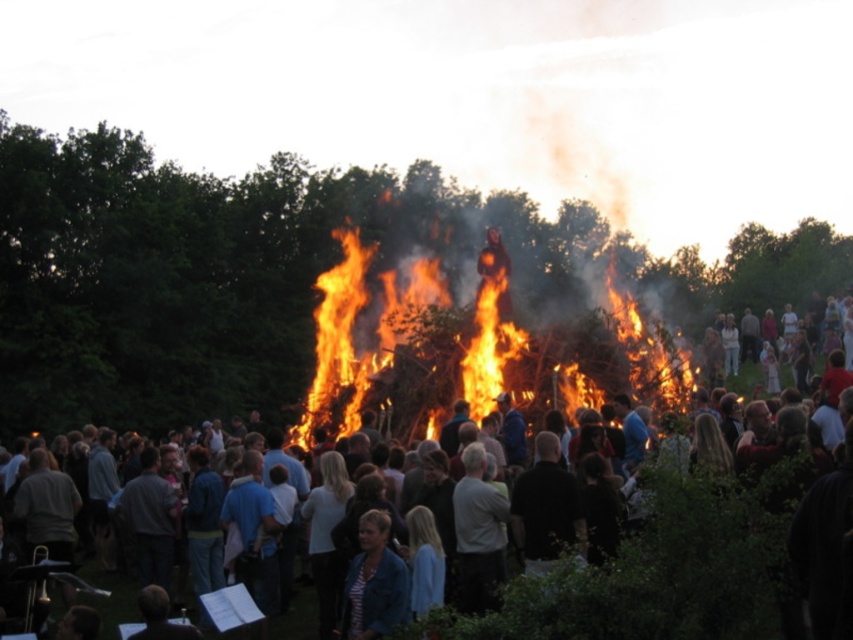
Does dark clothing crowd at center lie behind flaming wood at center?

No, it is in front of flaming wood at center.

Is point (677, 632) closer to camera compared to point (635, 371)?

Yes.

Where is `dark clothing crowd at center`? This screenshot has width=853, height=640. dark clothing crowd at center is located at coordinates (666, 568).